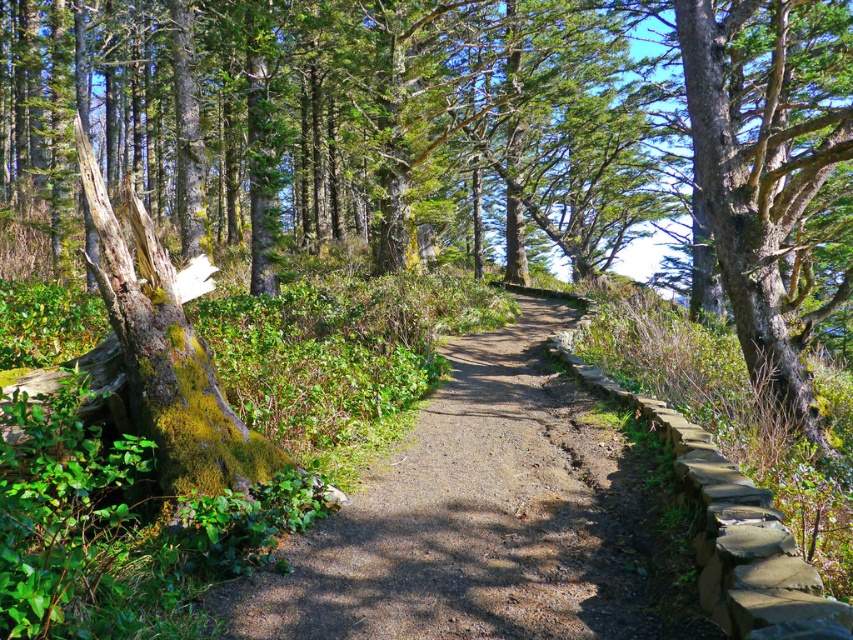
Question: Is dirt path at center below green mossy bark tree at center?

Choices:
 (A) yes
 (B) no

Answer: (A)

Question: Is dirt path at center above green mossy bark tree at center?

Choices:
 (A) yes
 (B) no

Answer: (B)

Question: Which of the following is the farthest from the observer?

Choices:
 (A) pyautogui.click(x=825, y=44)
 (B) pyautogui.click(x=257, y=616)

Answer: (A)

Question: In this image, where is dirt path at center located relative to green mossy bark tree at center?

Choices:
 (A) left
 (B) right

Answer: (A)